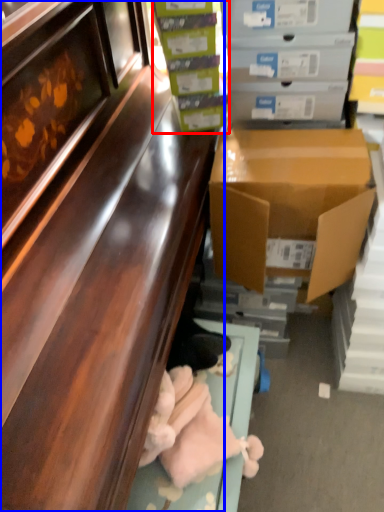
Question: Among these objects, which one is farthest to the camera, box (highlighted by a red box) or cabinetry (highlighted by a blue box)?

Choices:
 (A) box
 (B) cabinetry

Answer: (A)